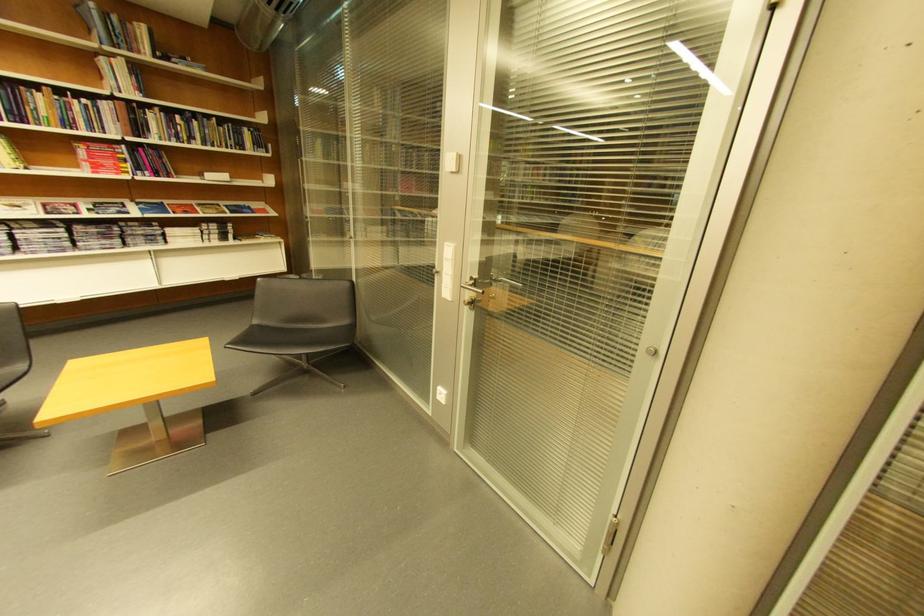
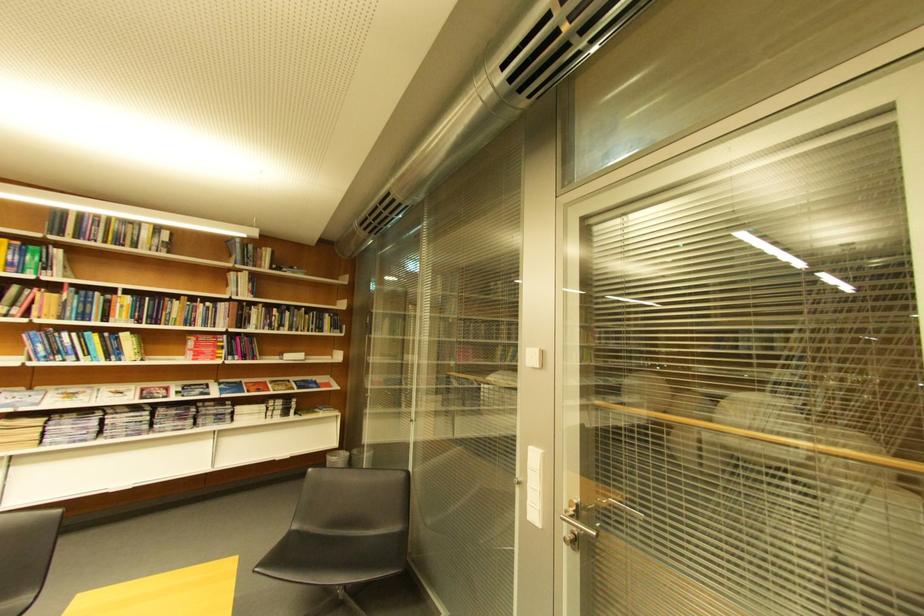
Question: The images are taken continuously from a first-person perspective. In which direction is your viewpoint rotating?

Choices:
 (A) Left
 (B) Right
 (C) Up
 (D) Down

Answer: (C)